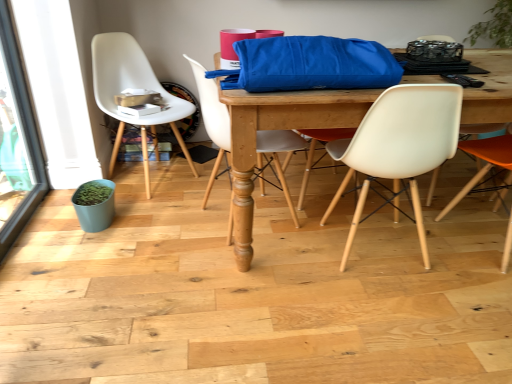
Question: Looking at their shapes, would you say orange matte chair at right, the 4th chair viewed from the left, is wider or thinner than black plastic remote control at upper right?

Choices:
 (A) thin
 (B) wide

Answer: (B)

Question: Looking at the image, does orange matte chair at right, which is the 1th chair from right to left, seem bigger or smaller compared to black plastic remote control at upper right?

Choices:
 (A) big
 (B) small

Answer: (A)

Question: Which object is positioned farthest from the transparent glass screen door at left?

Choices:
 (A) blue fabric bag at center
 (B) orange matte chair at right, which is the 1th chair from right to left
 (C) white plastic chair at center, which ranks as the third chair in left-to-right order
 (D) matte white chair at center, which is counted as the 3th chair, starting from the right
 (E) black plastic remote control at upper right

Answer: (B)

Question: Which object is positioned farthest from the white plastic chair at left, positioned as the first chair in left-to-right order?

Choices:
 (A) blue fabric bag at center
 (B) matte blue flowerpot at lower left
 (C) white plastic chair at center, which ranks as the third chair in left-to-right order
 (D) transparent glass screen door at left
 (E) orange matte chair at right, which is the 1th chair from right to left

Answer: (E)